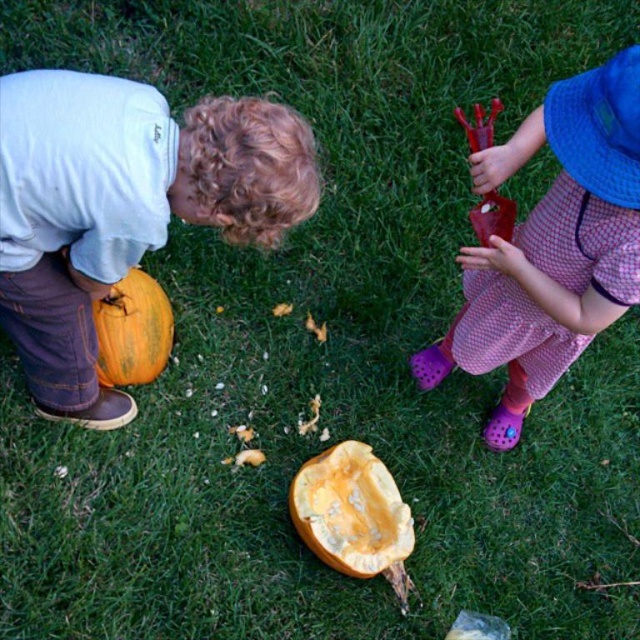
You are a parent watching your children play in the garden. You have two pumpkins, the matte orange pumpkin at left and the yellow matte pumpkin at center. Which pumpkin is taller?

The matte orange pumpkin at left is much taller than the yellow matte pumpkin at center.

You are a parent observing two children playing on a grassy lawn. You notice the matte orange pumpkin at left and the orange matte pumpkin at lower left. Which pumpkin is positioned more to the right?

Answer: The matte orange pumpkin at left is positioned more to the right than the orange matte pumpkin at lower left.

You are a parent watching your children playing on the grassy lawn. You notice two matte orange pumpkins. Which one is higher up, the matte orange pumpkin at left or the orange matte pumpkin at lower left?

The matte orange pumpkin at left is higher up than the orange matte pumpkin at lower left because it is located above it.